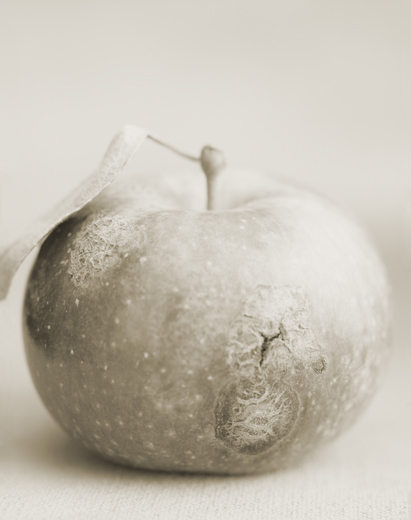
You are a GUI agent. You are given a task and a screenshot of the screen. Output one action in this format:
    pyautogui.click(x=<x>, y=<y>)
    Task: Click on the table surface
    
    Given the screenshot: What is the action you would take?
    pyautogui.click(x=359, y=498)